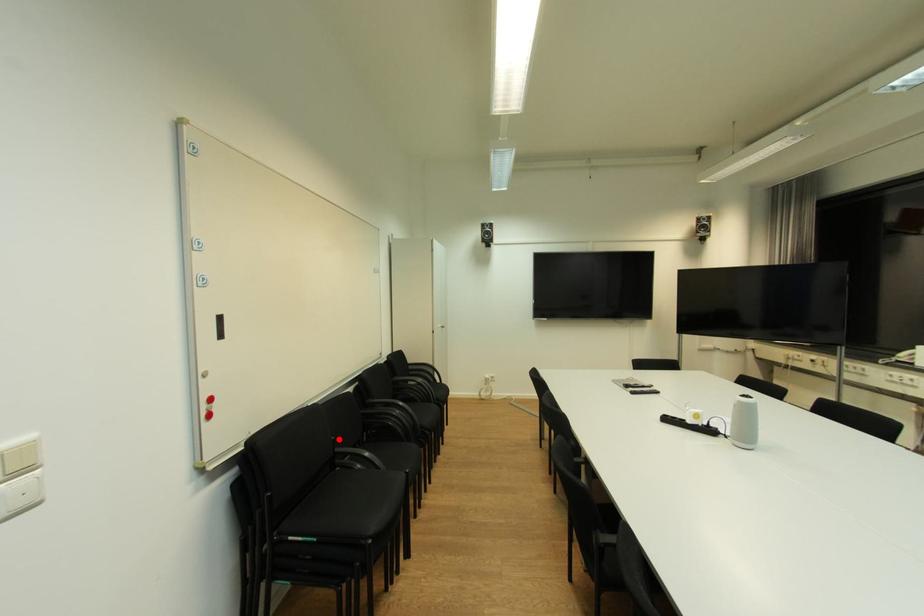
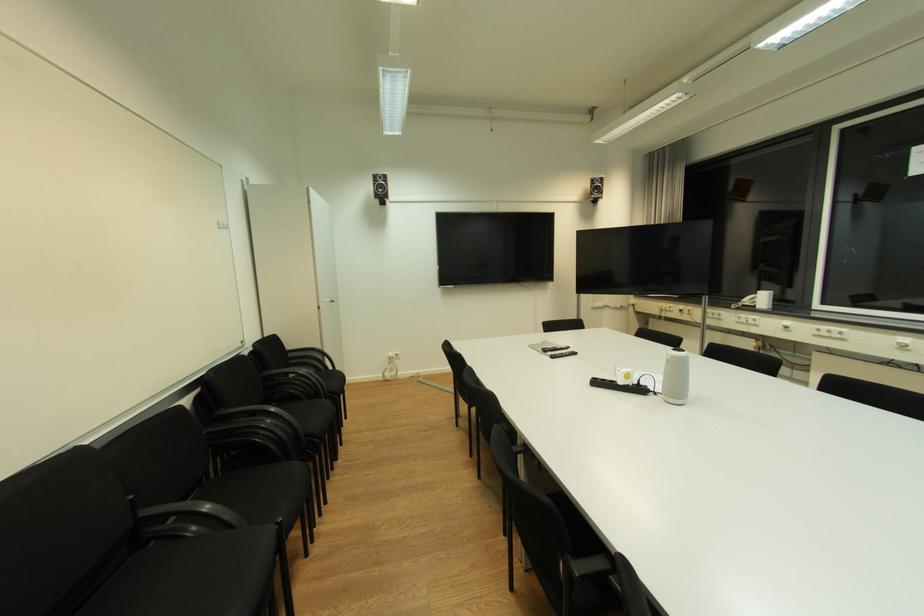
Question: I am providing you with two images of the same scene from different viewpoints. Image1 has a red point marked. In image2, the corresponding 3D location appears at what relative position? Reply with the corresponding letter.

Choices:
 (A) Closer
 (B) Farther

Answer: (B)